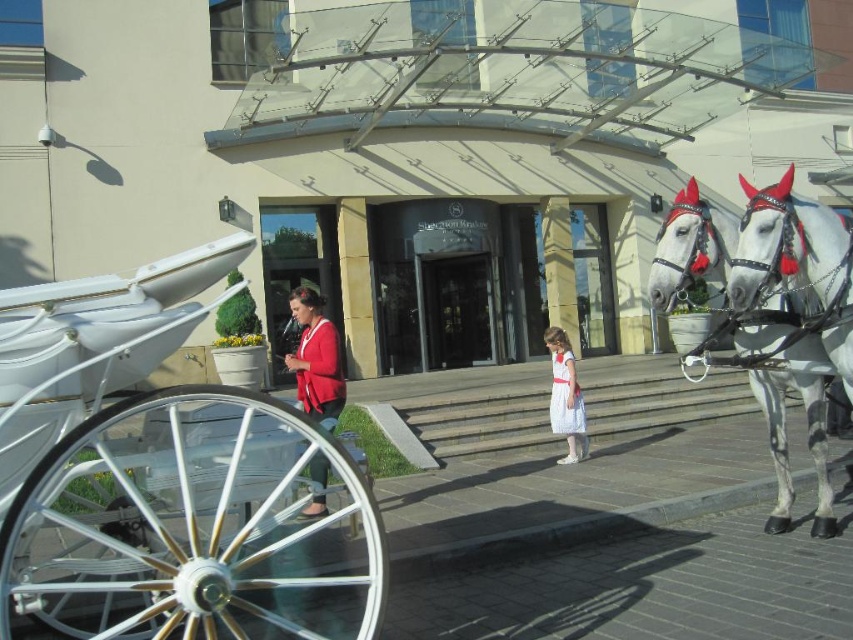
Looking at this image, you are a photographer standing at the entrance of the building. You want to take a photo of both the white speckled horse at right and the white glossy horse at right. Which horse should you focus on if you want to capture the wider subject in your shot?

The white glossy horse at right is wider than the white speckled horse at right, so you should focus on the white glossy horse at right to capture the wider subject in your shot.

You are standing at the entrance of the modern building and want to take a photo that includes both the white horse and the carriage. The white horse is at point (712, 268) and the carriage is at point (312, 406). Which object is closer to your camera so you can focus on it first?

Point (712, 268) is closer to the camera than point (312, 406), so you should focus on the white horse first.

You are a photographer standing in front of the modern building. You want to take a photo of both the white speckled horse at right and the white glossy horse at right. However, you notice that one horse is blocking the other. Which horse is blocking the other one?

The white speckled horse at right is positioned under the white glossy horse at right, so the white glossy horse at right is blocking the white speckled horse at right from view.